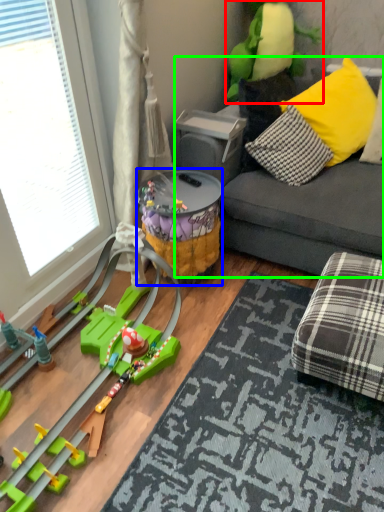
Question: Estimate the real-world distances between objects in this image. Which object is farther from toy (highlighted by a red box), toy (highlighted by a blue box) or studio couch (highlighted by a green box)?

Choices:
 (A) toy
 (B) studio couch

Answer: (A)